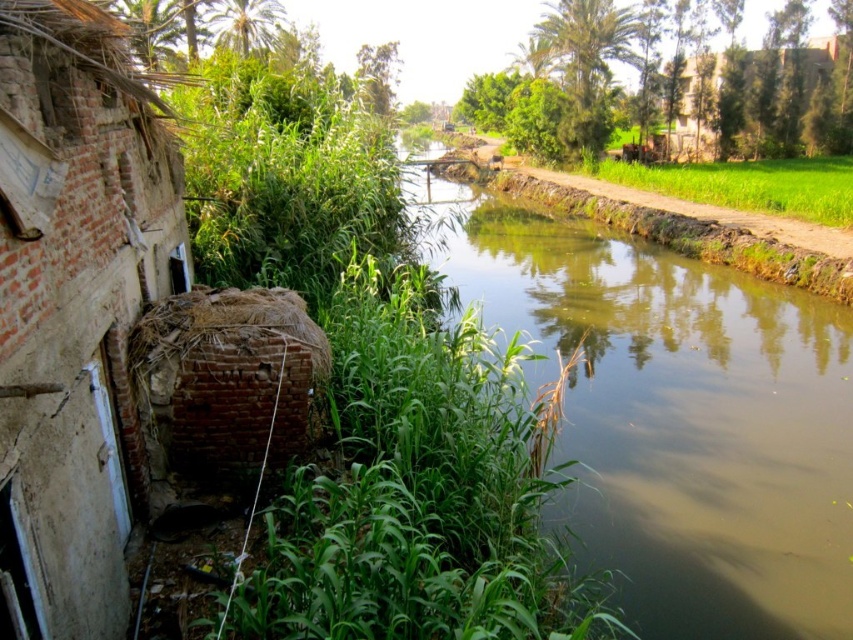
Question: Does green grassy stream at center lie behind brown brick building at upper right?

Choices:
 (A) no
 (B) yes

Answer: (A)

Question: Considering the real-world distances, which object is farthest from the brown brick building at upper right?

Choices:
 (A) green grassy stream at center
 (B) green grass at right

Answer: (A)

Question: Estimate the real-world distances between objects in this image. Which object is closer to the green grassy stream at center?

Choices:
 (A) brick wall at left
 (B) green grass at right
 (C) brown brick building at upper right

Answer: (B)

Question: Can you confirm if green grassy stream at center is positioned to the left of green grass at right?

Choices:
 (A) yes
 (B) no

Answer: (A)

Question: Estimate the real-world distances between objects in this image. Which object is closer to the green grass at right?

Choices:
 (A) green grassy stream at center
 (B) brick wall at left
 (C) brown brick building at upper right

Answer: (C)

Question: Observing the image, what is the correct spatial positioning of green grassy stream at center in reference to brown brick building at upper right?

Choices:
 (A) left
 (B) right

Answer: (A)